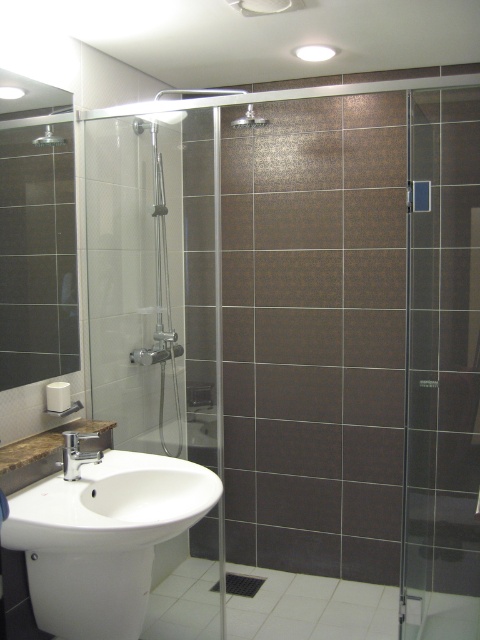
Question: Which object is closer to the camera taking this photo?

Choices:
 (A) matte silver faucet at lower left
 (B) matte silver showerhead at upper center

Answer: (A)

Question: Does white ceramic sink at lower left have a smaller size compared to matte silver shower head at upper left?

Choices:
 (A) yes
 (B) no

Answer: (B)

Question: Which of the following is the farthest from the observer?

Choices:
 (A) matte silver shower head at upper left
 (B) white glossy toilet bowl at lower left

Answer: (A)

Question: Is the position of transparent glass shower door at center less distant than that of white glossy toilet bowl at lower left?

Choices:
 (A) yes
 (B) no

Answer: (B)

Question: Which point is closer to the camera?

Choices:
 (A) (111, 596)
 (B) (242, 124)

Answer: (A)

Question: Where is transparent glass door at right located in relation to white ceramic sink at lower left in the image?

Choices:
 (A) left
 (B) right

Answer: (B)